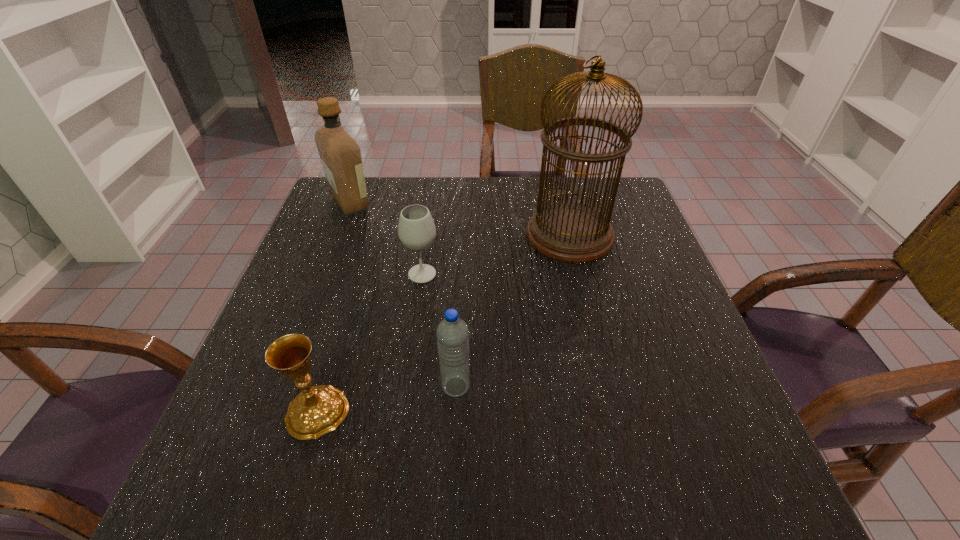
The width and height of the screenshot is (960, 540). I want to click on free spot between the rightmost object and the water bottle, so click(x=513, y=310).

Identify the location of free space between the second object from right to left and the second tallest object. pyautogui.click(x=403, y=295).

Find the location of a particular element. the third closest object to the birdcage is located at coordinates click(x=340, y=154).

Identify the location of object that can be found as the closest to the chalice. The image size is (960, 540). (452, 333).

Find the location of a particular element. free space that satisfies the following two spatial constraints: 1. on the front side of the second object from right to left; 2. on the left side of the wineglass is located at coordinates (406, 386).

Identify the location of free space that satisfies the following two spatial constraints: 1. on the front-facing side of the rightmost object; 2. on the front side of the second object from right to left. The width and height of the screenshot is (960, 540). (607, 386).

What are the coordinates of `vacant space that satisfies the following two spatial constraints: 1. on the front-facing side of the chalice; 2. on the right side of the liquor` in the screenshot? It's located at (271, 411).

Locate an element on the screen. free spot that satisfies the following two spatial constraints: 1. on the back side of the chalice; 2. on the front-facing side of the liquor is located at coordinates (379, 203).

This screenshot has width=960, height=540. Find the location of `vacant space that satisfies the following two spatial constraints: 1. on the front-facing side of the water bottle; 2. on the left side of the liquor`. vacant space that satisfies the following two spatial constraints: 1. on the front-facing side of the water bottle; 2. on the left side of the liquor is located at coordinates (280, 386).